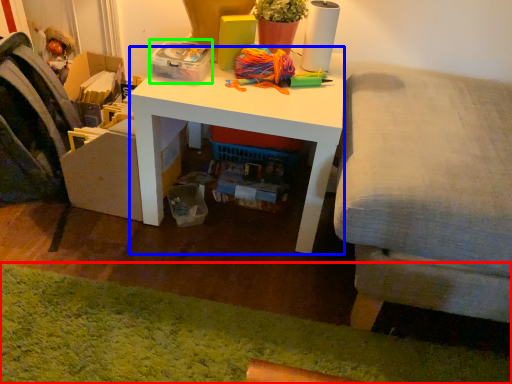
Question: Which is nearer to the mat (highlighted by a red box)? desk (highlighted by a blue box) or storage box (highlighted by a green box).

Choices:
 (A) desk
 (B) storage box

Answer: (A)